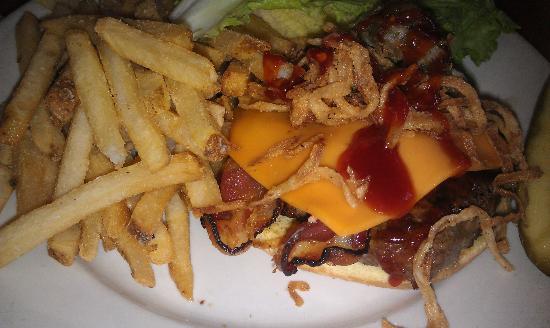
The height and width of the screenshot is (328, 550). Identify the location of plate. (139, 308).